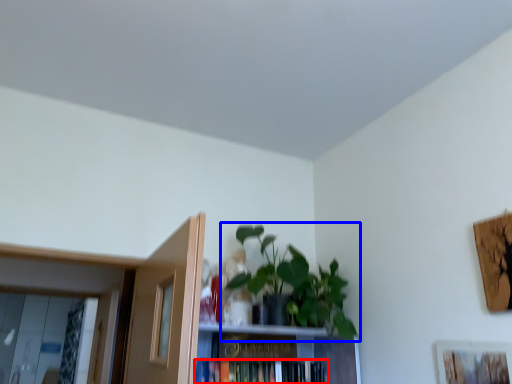
Question: Which object appears closest to the camera in this image, book (highlighted by a red box) or houseplant (highlighted by a blue box)?

Choices:
 (A) book
 (B) houseplant

Answer: (B)